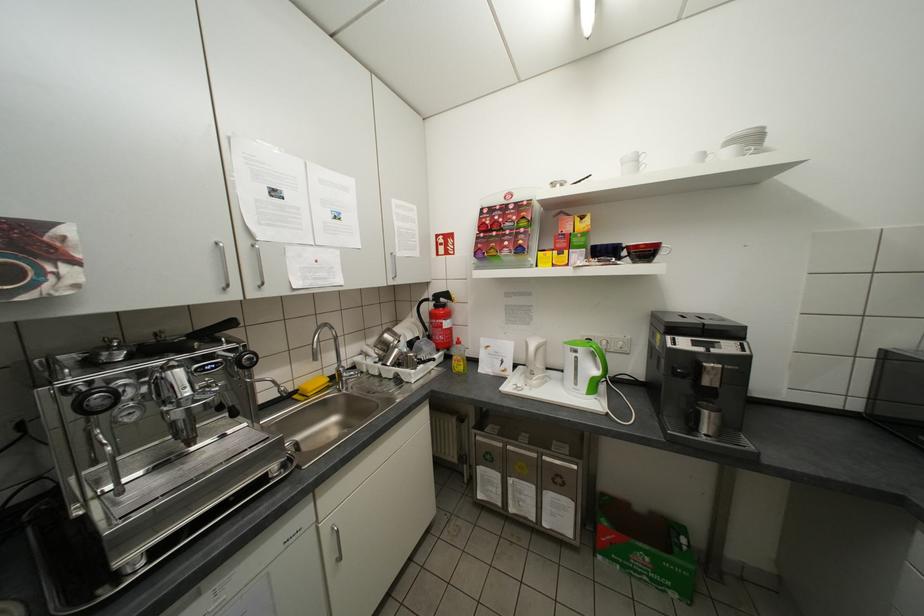
The width and height of the screenshot is (924, 616). Describe the element at coordinates (183, 389) in the screenshot. I see `the espresso machine lever` at that location.